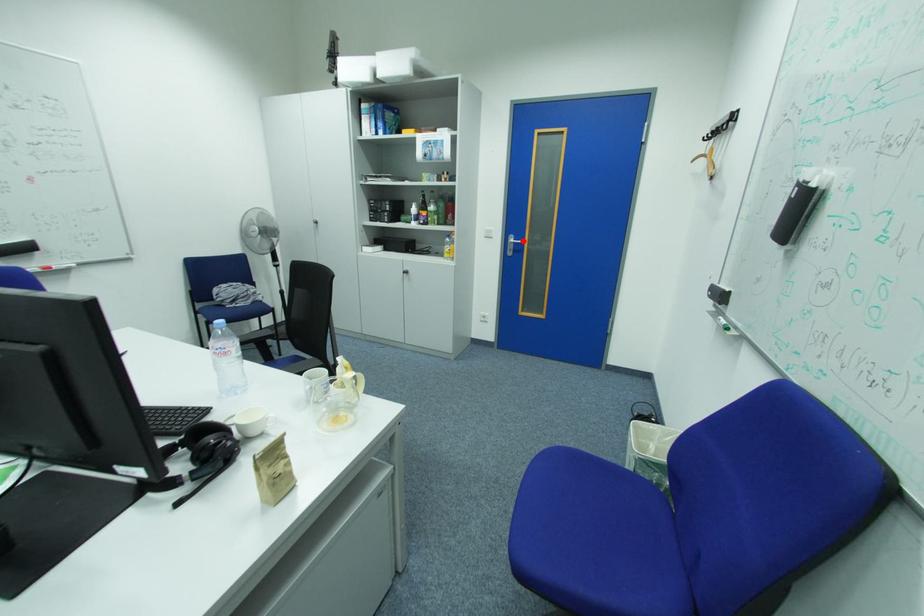
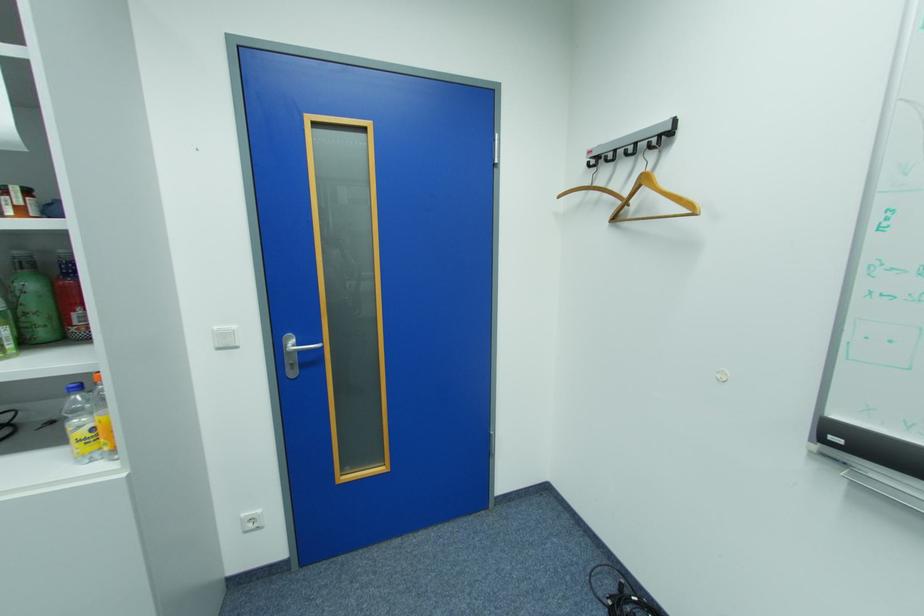
Where in the second image is the point corresponding to the highlighted location from the first image?

(307, 344)